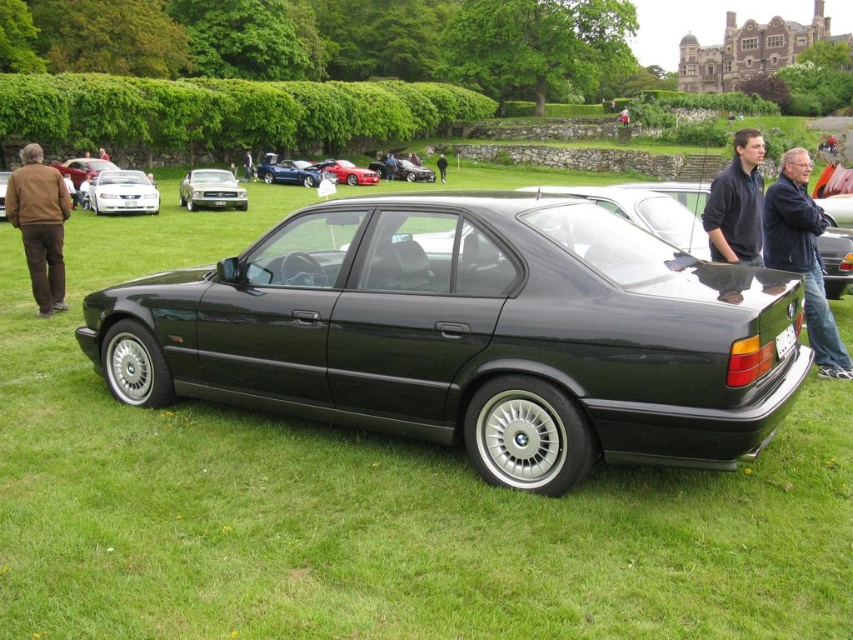
Between shiny red car at center and white plastic license plate at rear, which one appears on the left side from the viewer's perspective?

Positioned to the left is shiny red car at center.

Looking at this image, does shiny red car at center lie in front of white plastic license plate at rear?

No, shiny red car at center is behind white plastic license plate at rear.

Identify the location of shiny red car at center. This screenshot has height=640, width=853. (346, 172).

I want to click on shiny red car at center, so click(x=346, y=172).

Does dark blue jeans at right appear on the right side of shiny red car at center?

Correct, you'll find dark blue jeans at right to the right of shiny red car at center.

Find the location of a particular element. dark blue jeans at right is located at coordinates click(x=802, y=257).

Locate an element on the screen. This screenshot has height=640, width=853. dark blue jeans at right is located at coordinates (802, 257).

Can you confirm if brown leather jacket at left is positioned to the right of matte black sedan at center?

In fact, brown leather jacket at left is to the left of matte black sedan at center.

Which is behind, point (50, 236) or point (3, 184)?

The point (3, 184) is more distant.

Locate an element on the screen. This screenshot has width=853, height=640. brown leather jacket at left is located at coordinates (39, 225).